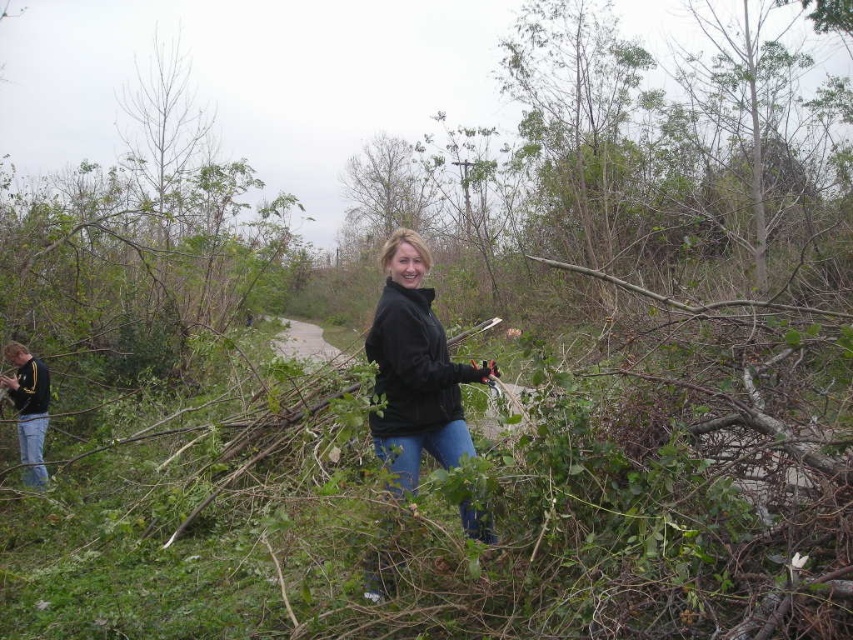
Who is positioned more to the left, black matte jacket at center or jeans at left?

jeans at left

Between black matte jacket at center and jeans at left, which one is positioned lower?

jeans at left

Between point (410, 429) and point (4, 348), which one is positioned behind?

The point (4, 348) is behind.

Image resolution: width=853 pixels, height=640 pixels. Find the location of `black matte jacket at center`. black matte jacket at center is located at coordinates pos(415,369).